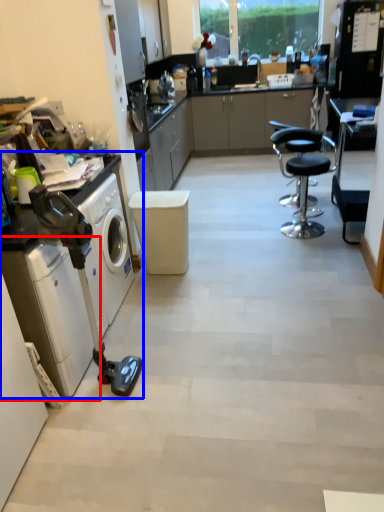
Question: Among these objects, which one is farthest to the camera, washing machine (highlighted by a red box) or home appliance (highlighted by a blue box)?

Choices:
 (A) washing machine
 (B) home appliance

Answer: (A)